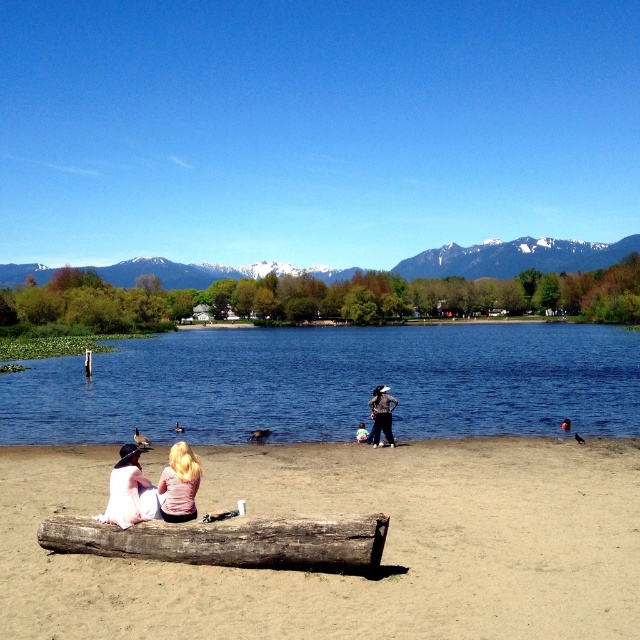
Question: Is blue water at center thinner than light pink fabric shirt at center?

Choices:
 (A) no
 (B) yes

Answer: (A)

Question: Which point is closer to the camera taking this photo?

Choices:
 (A) (182, 513)
 (B) (612, 570)

Answer: (B)

Question: Does blue water at center appear under matte black jacket at center?

Choices:
 (A) no
 (B) yes

Answer: (A)

Question: Which point is farther to the camera?

Choices:
 (A) (396, 612)
 (B) (152, 492)
 (C) (228, 545)
 (D) (108, 365)

Answer: (D)

Question: Considering the relative positions of brown sandy beach at lower center and matte black jacket at center in the image provided, where is brown sandy beach at lower center located with respect to matte black jacket at center?

Choices:
 (A) left
 (B) right

Answer: (B)

Question: Based on their relative distances, which object is farther from the light pink fabric shirt at center?

Choices:
 (A) blue water at center
 (B) matte black jacket at center

Answer: (A)